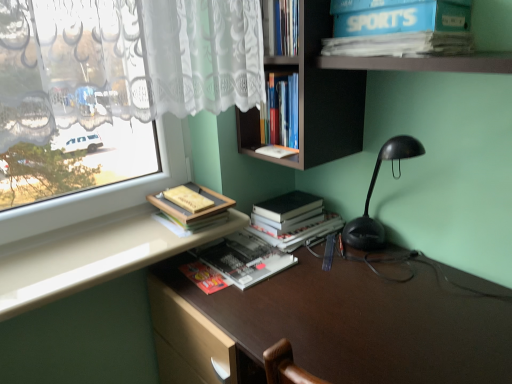
Question: Does white glossy counter top at lower left lie behind hardcover black book at center, positioned as the 3th book in top-to-bottom order?

Choices:
 (A) no
 (B) yes

Answer: (A)

Question: From a real-world perspective, does white glossy counter top at lower left stand above hardcover black book at center, positioned as the 3th book in top-to-bottom order?

Choices:
 (A) yes
 (B) no

Answer: (A)

Question: Would you say white glossy counter top at lower left is a long distance from hardcover black book at center, the 2th book from the bottom?

Choices:
 (A) yes
 (B) no

Answer: (B)

Question: Are white glossy counter top at lower left and hardcover black book at center, the 2th book from the bottom, beside each other?

Choices:
 (A) yes
 (B) no

Answer: (B)

Question: Considering the relative sizes of white glossy counter top at lower left and hardcover black book at center, the 2th book from the bottom, in the image provided, is white glossy counter top at lower left smaller than hardcover black book at center, the 2th book from the bottom,?

Choices:
 (A) no
 (B) yes

Answer: (B)

Question: Does white glossy counter top at lower left appear on the right side of hardcover black book at center, positioned as the 3th book in top-to-bottom order?

Choices:
 (A) no
 (B) yes

Answer: (A)

Question: Does brown matte desk at center appear on the left side of matte yellow book at upper left, arranged as the 2th book when viewed from the top?

Choices:
 (A) yes
 (B) no

Answer: (B)

Question: Can you see brown matte desk at center touching matte yellow book at upper left, the third book in the bottom-to-top sequence?

Choices:
 (A) yes
 (B) no

Answer: (B)

Question: Is brown matte desk at center oriented towards matte yellow book at upper left, the third book in the bottom-to-top sequence?

Choices:
 (A) yes
 (B) no

Answer: (B)

Question: From a real-world perspective, is brown matte desk at center located higher than matte yellow book at upper left, the third book in the bottom-to-top sequence?

Choices:
 (A) no
 (B) yes

Answer: (A)

Question: From the image's perspective, is brown matte desk at center under matte yellow book at upper left, arranged as the 2th book when viewed from the top?

Choices:
 (A) no
 (B) yes

Answer: (B)

Question: Considering the relative sizes of brown matte desk at center and matte yellow book at upper left, arranged as the 2th book when viewed from the top, in the image provided, is brown matte desk at center thinner than matte yellow book at upper left, arranged as the 2th book when viewed from the top,?

Choices:
 (A) yes
 (B) no

Answer: (B)

Question: From a real-world perspective, is hardcover black book at center, positioned as the 3th book in top-to-bottom order, over hardcover book at center, marked as the fourth book in a top-to-bottom arrangement?

Choices:
 (A) yes
 (B) no

Answer: (A)